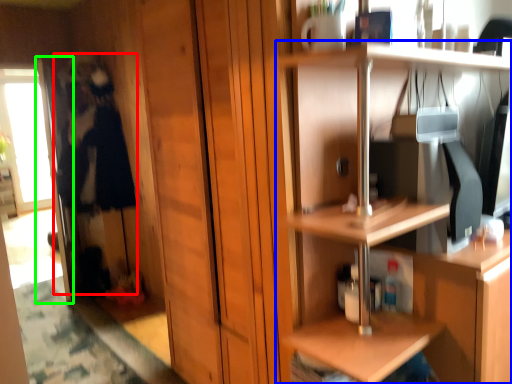
Question: Estimate the real-world distances between objects in this image. Which object is farther from person (highlighted by a red box), shelf (highlighted by a blue box) or screen door (highlighted by a green box)?

Choices:
 (A) shelf
 (B) screen door

Answer: (A)